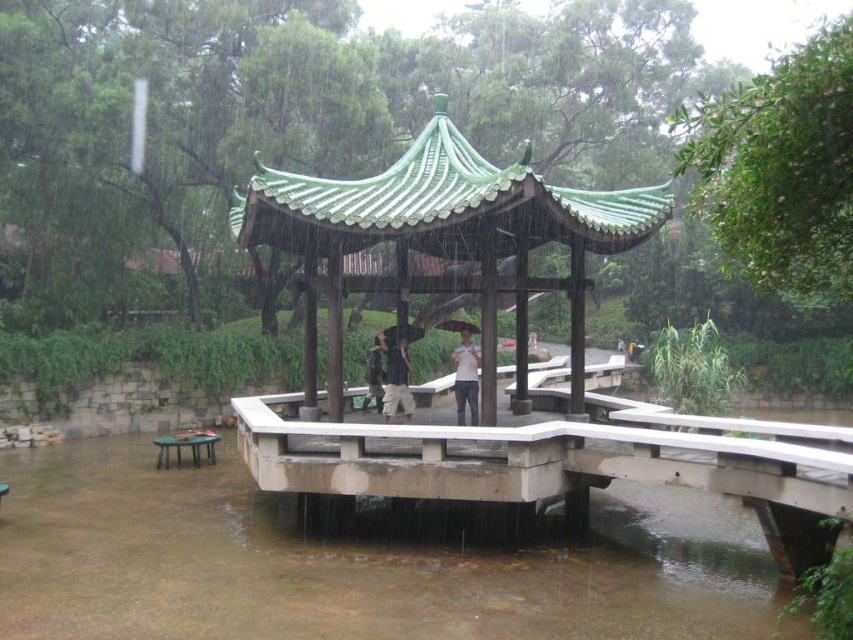
You are standing at the pavilion and want to walk to both points marked in the image. Which point, point (267, 531) or point (383, 342), will you reach first?

You will reach point (267, 531) first because it is closer to the viewer than point (383, 342).

You are a visitor standing on the elevated platform of the pavilion. You want to place a small potted plant between the clear concrete flood at lower center and the dark blue fabric umbrella at center. Based on their widths, which object should the plant be closer to?

The clear concrete flood at lower center is wider than the dark blue fabric umbrella at center. Therefore, the plant should be placed closer to the dark blue fabric umbrella at center to ensure it fits within the narrower space.